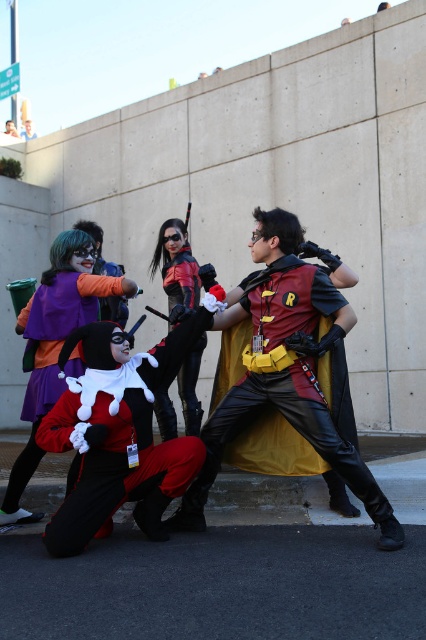
Question: Which object is positioned closest to the matte red costume at center?

Choices:
 (A) shiny red vest at center
 (B) white plush santa hat at lower left
 (C) black leather gloves at center

Answer: (B)

Question: Is shiny red vest at center to the left of matte red costume at center from the viewer's perspective?

Choices:
 (A) no
 (B) yes

Answer: (A)

Question: Is shiny red vest at center smaller than black leather gloves at center?

Choices:
 (A) no
 (B) yes

Answer: (A)

Question: Among these objects, which one is farthest from the camera?

Choices:
 (A) matte red costume at center
 (B) shiny red vest at center

Answer: (A)

Question: Which of the following is the farthest from the observer?

Choices:
 (A) (356, 460)
 (B) (48, 541)

Answer: (A)

Question: In this image, where is shiny red vest at center located relative to black leather gloves at center?

Choices:
 (A) above
 (B) below

Answer: (A)